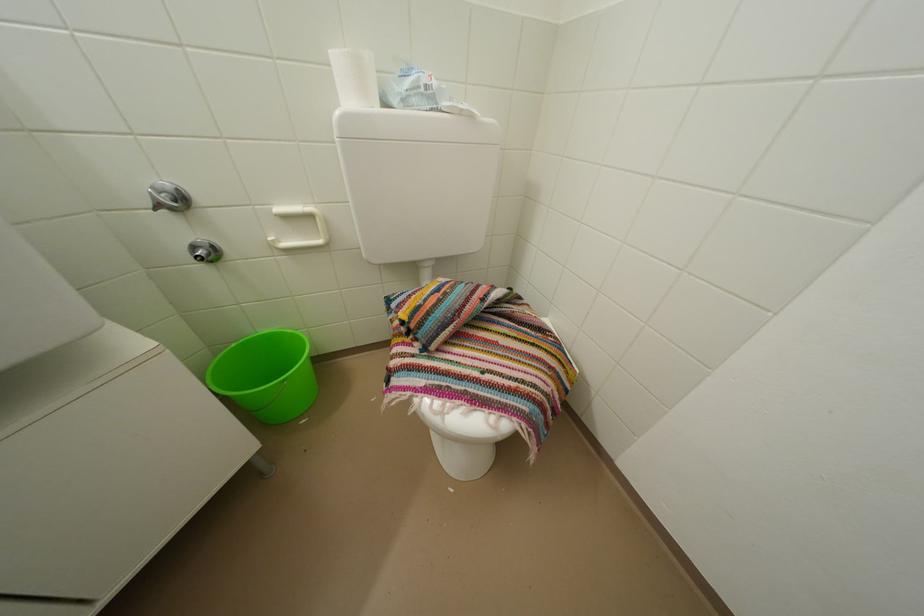
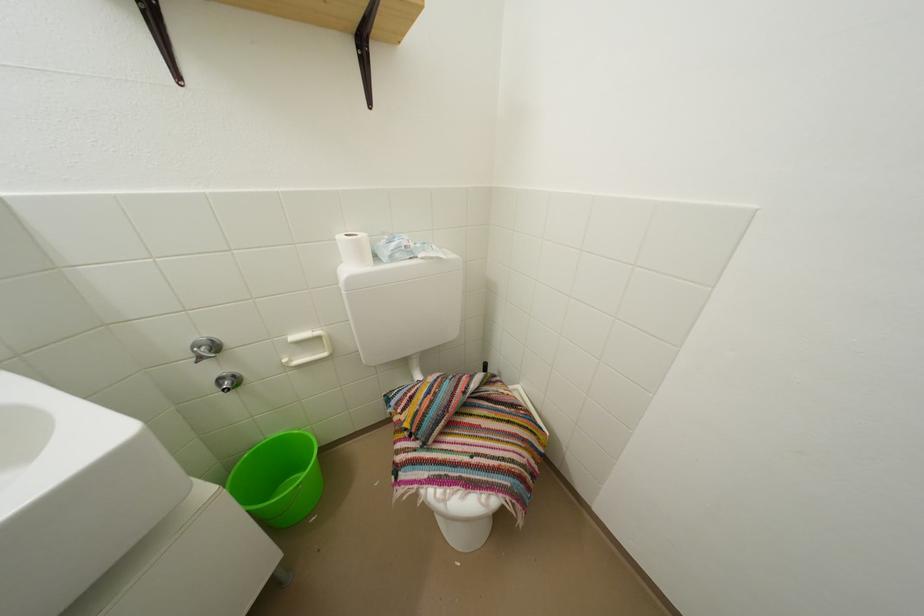
Where in the second image is the point corresponding to point 418,87 from the first image?

(402, 251)